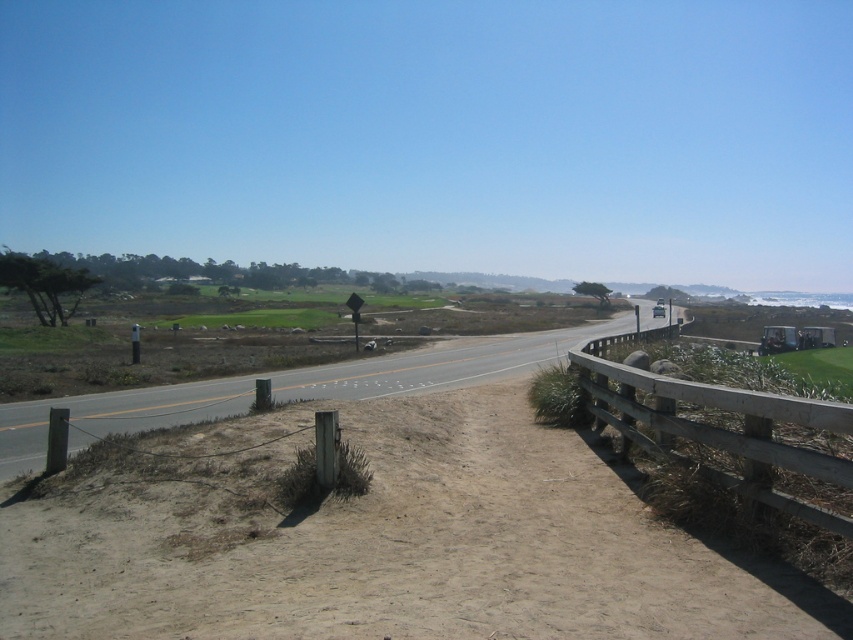
Question: Which object is farther from the camera taking this photo?

Choices:
 (A) asphalt road at center
 (B) wooden fence at right

Answer: (A)

Question: Is wooden fence at right below asphalt road at center?

Choices:
 (A) yes
 (B) no

Answer: (A)

Question: Which of the following is the closest to the observer?

Choices:
 (A) asphalt road at center
 (B) wooden fence at right

Answer: (B)

Question: Which object is farther from the camera taking this photo?

Choices:
 (A) asphalt road at center
 (B) wooden fence at right

Answer: (A)

Question: Considering the relative positions of wooden fence at right and asphalt road at center in the image provided, where is wooden fence at right located with respect to asphalt road at center?

Choices:
 (A) left
 (B) right

Answer: (A)

Question: Considering the relative positions of wooden fence at right and asphalt road at center in the image provided, where is wooden fence at right located with respect to asphalt road at center?

Choices:
 (A) right
 (B) left

Answer: (B)